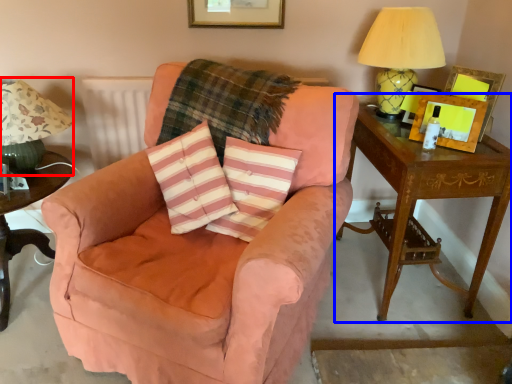
Question: Which object is closer to the camera taking this photo, table lamp (highlighted by a red box) or table (highlighted by a blue box)?

Choices:
 (A) table lamp
 (B) table

Answer: (A)